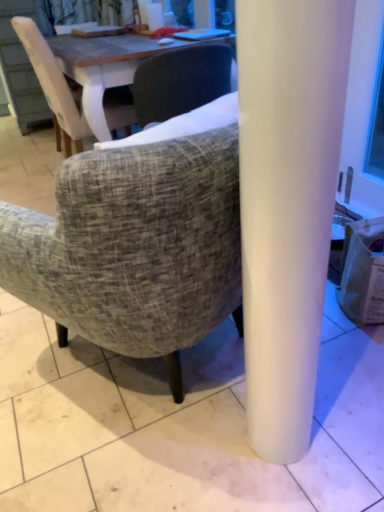
Where is `textured fabric chair at center, the 1th chair from the front`? This screenshot has width=384, height=512. textured fabric chair at center, the 1th chair from the front is located at coordinates (135, 247).

Locate an element on the screen. The image size is (384, 512). light brown fabric chair at upper left, which appears as the 1th chair when viewed from the left is located at coordinates (54, 86).

The width and height of the screenshot is (384, 512). I want to click on trash bin/can below the light brown fabric chair at upper left, which appears as the 1th chair when viewed from the left (from a real-world perspective), so click(363, 272).

From the image's perspective, who appears lower, brown paper bag at lower right or light brown fabric chair at upper left, the second chair positioned from the bottom?

brown paper bag at lower right.

Which of these two, brown paper bag at lower right or light brown fabric chair at upper left, the second chair positioned from the bottom, stands taller?

light brown fabric chair at upper left, the second chair positioned from the bottom.

Is brown paper bag at lower right smaller than light brown fabric chair at upper left, which appears as the 1th chair when viewed from the left?

Yes, brown paper bag at lower right is smaller than light brown fabric chair at upper left, which appears as the 1th chair when viewed from the left.

Identify the location of trash bin/can that appears on the right of light brown fabric chair at upper left, which appears as the 1th chair when viewed from the top. (363, 272).

Which object is positioned more to the right, light brown fabric chair at upper left, which appears as the 1th chair when viewed from the left, or brown paper bag at lower right?

brown paper bag at lower right is more to the right.

Could you tell me if light brown fabric chair at upper left, which appears as the 1th chair when viewed from the top, is facing brown paper bag at lower right?

No, light brown fabric chair at upper left, which appears as the 1th chair when viewed from the top, does not turn towards brown paper bag at lower right.

Can you tell me how much light brown fabric chair at upper left, which appears as the 1th chair when viewed from the left, and brown paper bag at lower right differ in facing direction?

The angular difference between light brown fabric chair at upper left, which appears as the 1th chair when viewed from the left, and brown paper bag at lower right is 171 degrees.

Is textured fabric chair at center, the first chair ordered from the bottom, located within brown paper bag at lower right?

No, textured fabric chair at center, the first chair ordered from the bottom, is not inside brown paper bag at lower right.

From the image's perspective, is brown paper bag at lower right beneath textured fabric chair at center, the first chair ordered from the bottom?

Indeed, from the image's perspective, brown paper bag at lower right is shown beneath textured fabric chair at center, the first chair ordered from the bottom.

Measure the distance from brown paper bag at lower right to textured fabric chair at center, placed as the second chair when sorted from left to right.

77.65 centimeters.

The image size is (384, 512). There is a brown paper bag at lower right. In order to click on the 1st chair above it (from the image's perspective) in this screenshot , I will do `click(135, 247)`.

How different are the orientations of light brown fabric chair at upper left, which appears as the 1th chair when viewed from the top, and textured fabric chair at center, placed as the second chair when sorted from left to right, in degrees?

118 degrees.

Find the location of a particular element. The image size is (384, 512). chair located on the left of textured fabric chair at center, the first chair ordered from the bottom is located at coordinates (54, 86).

Are light brown fabric chair at upper left, which appears as the 1th chair when viewed from the top, and textured fabric chair at center, the first chair ordered from the bottom, located far from each other?

Yes, light brown fabric chair at upper left, which appears as the 1th chair when viewed from the top, and textured fabric chair at center, the first chair ordered from the bottom, are located far from each other.

Is light brown fabric chair at upper left, which is the second chair from right to left, bigger or smaller than textured fabric chair at center, which is the second chair from back to front?

Considering their sizes, light brown fabric chair at upper left, which is the second chair from right to left, takes up more space than textured fabric chair at center, which is the second chair from back to front.

Which is correct: textured fabric chair at center, which is the second chair from back to front, is inside brown paper bag at lower right, or outside of it?

textured fabric chair at center, which is the second chair from back to front, cannot be found inside brown paper bag at lower right.

Does textured fabric chair at center, the 1th chair positioned from the right, come in front of brown paper bag at lower right?

Yes, textured fabric chair at center, the 1th chair positioned from the right, is closer to the viewer.

Is textured fabric chair at center, placed as the second chair when sorted from left to right, bigger or smaller than brown paper bag at lower right?

Considering their sizes, textured fabric chair at center, placed as the second chair when sorted from left to right, takes up more space than brown paper bag at lower right.

In the image, is textured fabric chair at center, which is the 2th chair from top to bottom, on the left side or the right side of brown paper bag at lower right?

From the image, it's evident that textured fabric chair at center, which is the 2th chair from top to bottom, is to the left of brown paper bag at lower right.

Based on the photo, which is more to the left, textured fabric chair at center, which is the 2th chair from top to bottom, or light brown fabric chair at upper left, the 1th chair when ordered from back to front?

light brown fabric chair at upper left, the 1th chair when ordered from back to front, is more to the left.

Which of these two, textured fabric chair at center, which is the second chair from back to front, or light brown fabric chair at upper left, which appears as the 1th chair when viewed from the left, is wider?

light brown fabric chair at upper left, which appears as the 1th chair when viewed from the left.

Is textured fabric chair at center, which is the second chair from back to front, further to the viewer compared to light brown fabric chair at upper left, the second chair positioned from the bottom?

No, the depth of textured fabric chair at center, which is the second chair from back to front, is less than that of light brown fabric chair at upper left, the second chair positioned from the bottom.

Locate an element on the screen. The image size is (384, 512). trash bin/can on the right of the light brown fabric chair at upper left, which appears as the 1th chair when viewed from the top is located at coordinates (363, 272).

From the image's perspective, count 2nd chairs upward from the brown paper bag at lower right and point to it. Please provide its 2D coordinates.

[(54, 86)]

Estimate the real-world distances between objects in this image. Which object is further from brown paper bag at lower right, light brown fabric chair at upper left, which appears as the 1th chair when viewed from the top, or textured fabric chair at center, the 1th chair from the front?

The object further to brown paper bag at lower right is light brown fabric chair at upper left, which appears as the 1th chair when viewed from the top.

When comparing their distances from textured fabric chair at center, placed as the second chair when sorted from left to right, does light brown fabric chair at upper left, the 1th chair when ordered from back to front, or brown paper bag at lower right seem closer?

The object closer to textured fabric chair at center, placed as the second chair when sorted from left to right, is brown paper bag at lower right.

Based on their spatial positions, is textured fabric chair at center, the first chair ordered from the bottom, or light brown fabric chair at upper left, the 1th chair when ordered from back to front, closer to brown paper bag at lower right?

textured fabric chair at center, the first chair ordered from the bottom, lies closer to brown paper bag at lower right than the other object.

When comparing their distances from textured fabric chair at center, which is the second chair from back to front, does brown paper bag at lower right or light brown fabric chair at upper left, which appears as the 1th chair when viewed from the top, seem closer?

brown paper bag at lower right is positioned closer to the anchor textured fabric chair at center, which is the second chair from back to front.

Estimate the real-world distances between objects in this image. Which object is further from light brown fabric chair at upper left, the 2th chair in the front-to-back sequence, textured fabric chair at center, which is the second chair from back to front, or brown paper bag at lower right?

brown paper bag at lower right is further to light brown fabric chair at upper left, the 2th chair in the front-to-back sequence.

Looking at the image, which one is located closer to light brown fabric chair at upper left, which appears as the 1th chair when viewed from the left, brown paper bag at lower right or textured fabric chair at center, the 1th chair from the front?

The object closer to light brown fabric chair at upper left, which appears as the 1th chair when viewed from the left, is textured fabric chair at center, the 1th chair from the front.

Where is `trash bin/can between textured fabric chair at center, which is the second chair from back to front, and light brown fabric chair at upper left, the 2th chair in the front-to-back sequence, from front to back`? The image size is (384, 512). trash bin/can between textured fabric chair at center, which is the second chair from back to front, and light brown fabric chair at upper left, the 2th chair in the front-to-back sequence, from front to back is located at coordinates (363, 272).